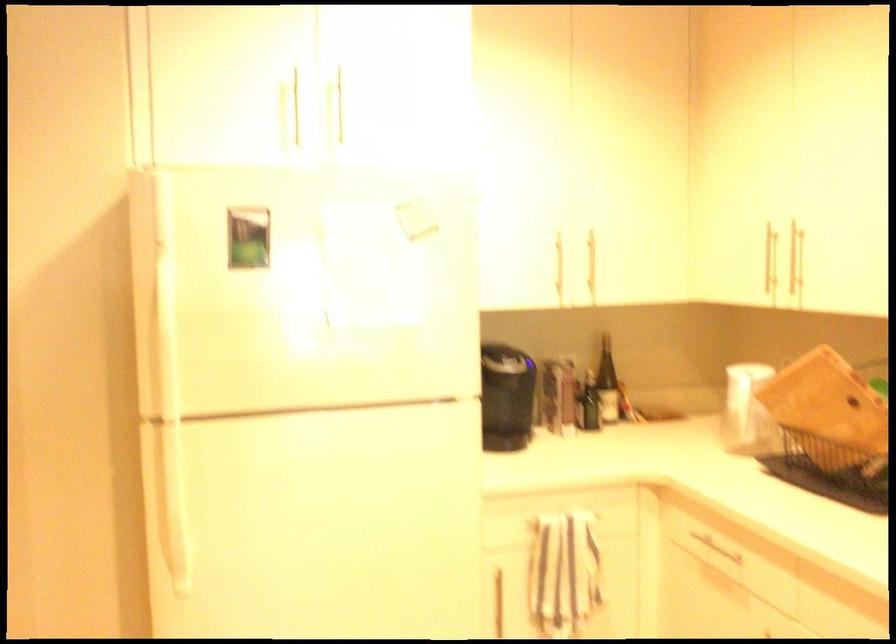
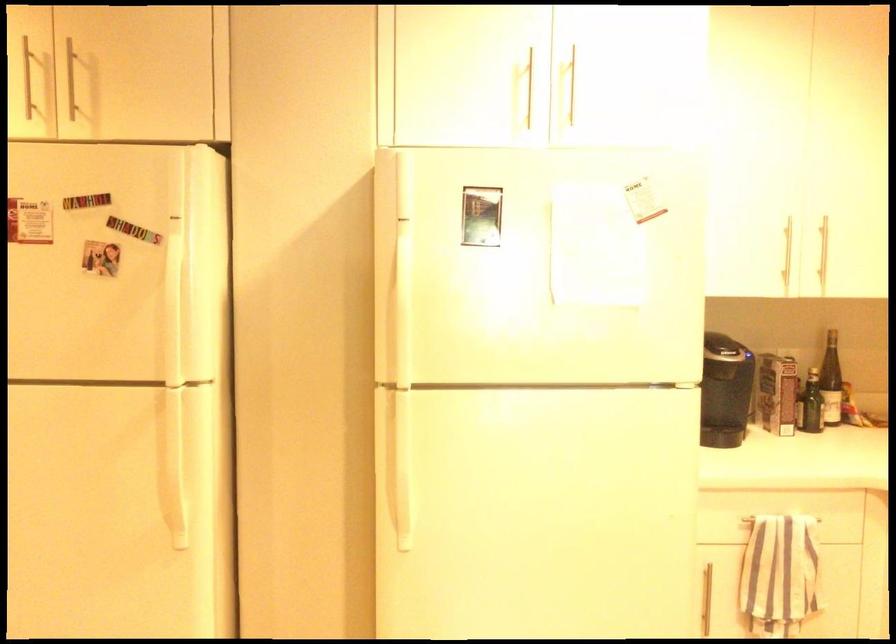
Where in the second image is the point corresponding to pixel 566 518 from the first image?

(781, 518)